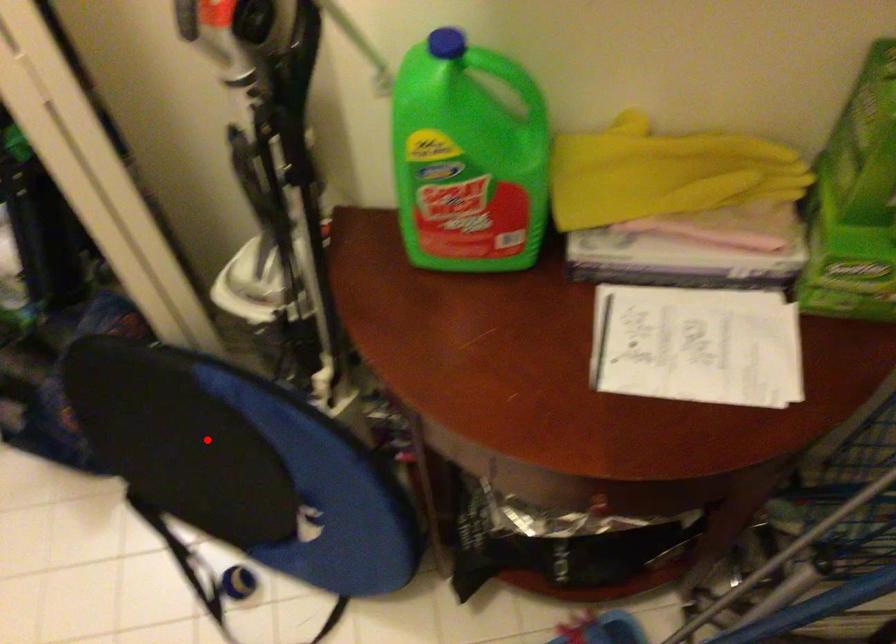
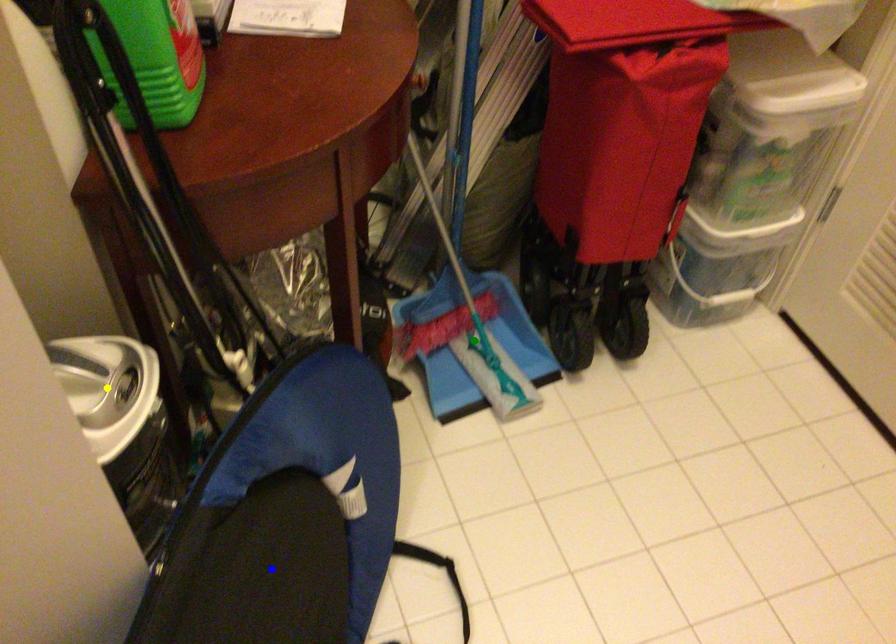
Question: I am providing you with two images of the same scene from different viewpoints. A red point is marked on the first image. You are given multiple points on the second image. Which spot in image 2 lines up with the point in image 1?

Choices:
 (A) yellow point
 (B) blue point
 (C) green point

Answer: (B)